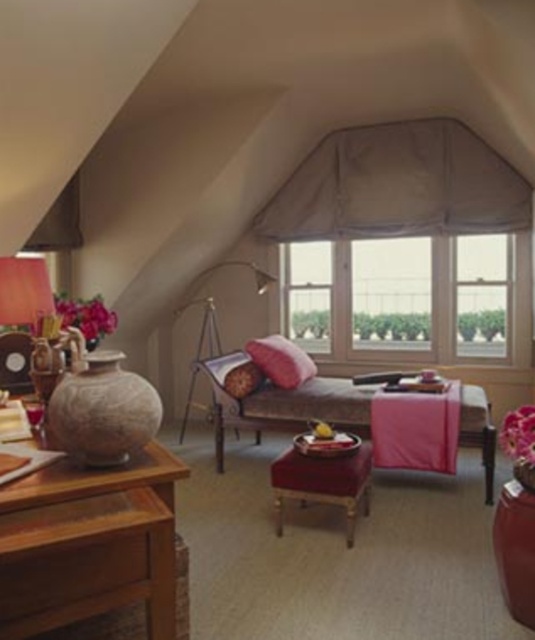
Between wooden window at center and metallic gold floor lamp at center, which one has more height?

metallic gold floor lamp at center is taller.

Measure the distance between wooden window at center and camera.

They are 5.44 meters apart.

The height and width of the screenshot is (640, 535). Find the location of `wooden window at center`. wooden window at center is located at coordinates (408, 296).

Does wooden table at left have a lesser height compared to pink fabric couch at center?

Correct, wooden table at left is not as tall as pink fabric couch at center.

Between wooden table at left and pink fabric couch at center, which one appears on the left side from the viewer's perspective?

From the viewer's perspective, wooden table at left appears more on the left side.

Who is more forward, (149,480) or (485,442)?

Point (149,480) is more forward.

Identify the location of wooden table at left. (94, 545).

Is matte pink pillow at center taller than matte brown armchair at left?

Yes, matte pink pillow at center is taller than matte brown armchair at left.

Who is positioned more to the right, matte pink pillow at center or matte brown armchair at left?

matte pink pillow at center

Identify the location of matte pink pillow at center. click(x=280, y=360).

This screenshot has width=535, height=640. In order to click on matte pink pillow at center in this screenshot , I will do `click(280, 360)`.